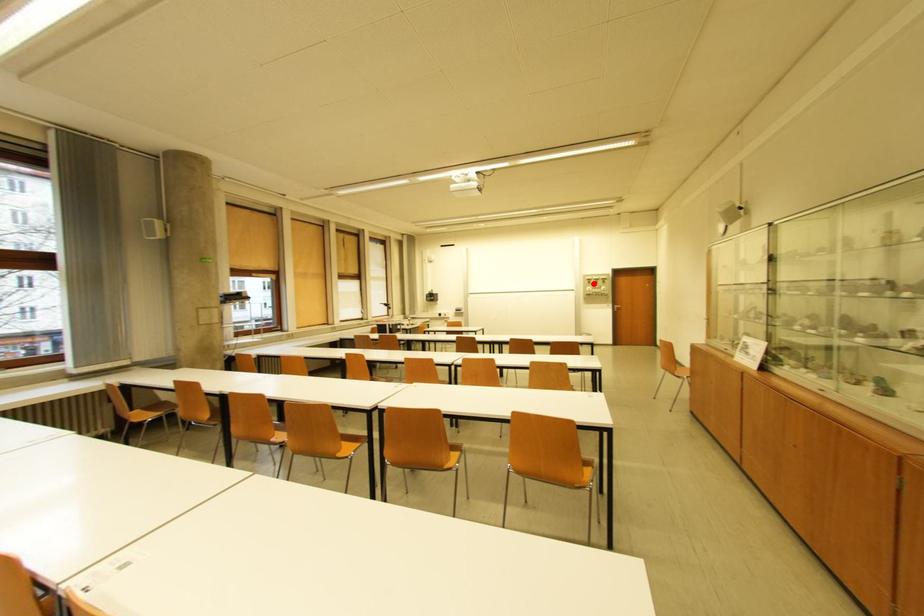
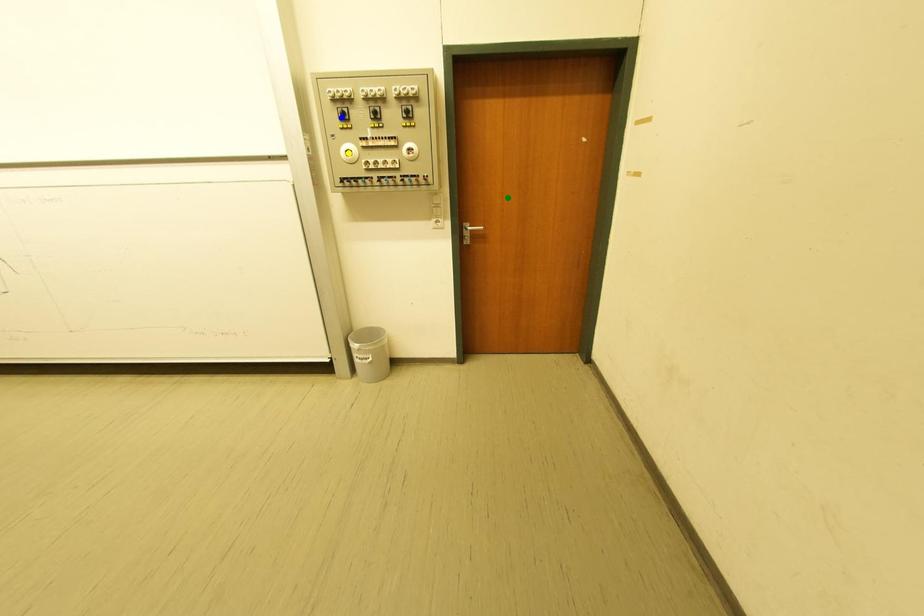
Question: I am providing you with two images of the same scene from different viewpoints. A red point is marked on the first image. You are given multiple points on the second image. Can you choose the point in image 2 that corresponds to the point in image 1?

Choices:
 (A) yellow point
 (B) blue point
 (C) green point

Answer: (B)